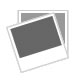
Image resolution: width=80 pixels, height=80 pixels. In order to click on light in this screenshot , I will do `click(25, 17)`.